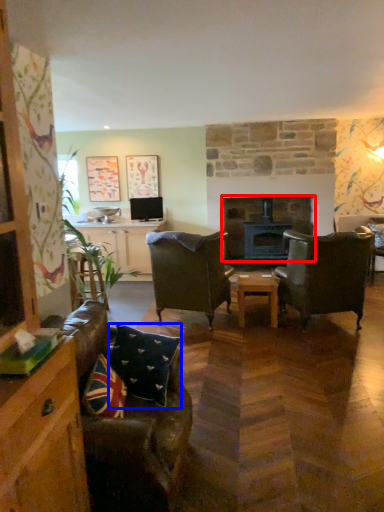
Question: Which object appears farthest to the camera in this image, fireplace (highlighted by a red box) or pillow (highlighted by a blue box)?

Choices:
 (A) fireplace
 (B) pillow

Answer: (A)